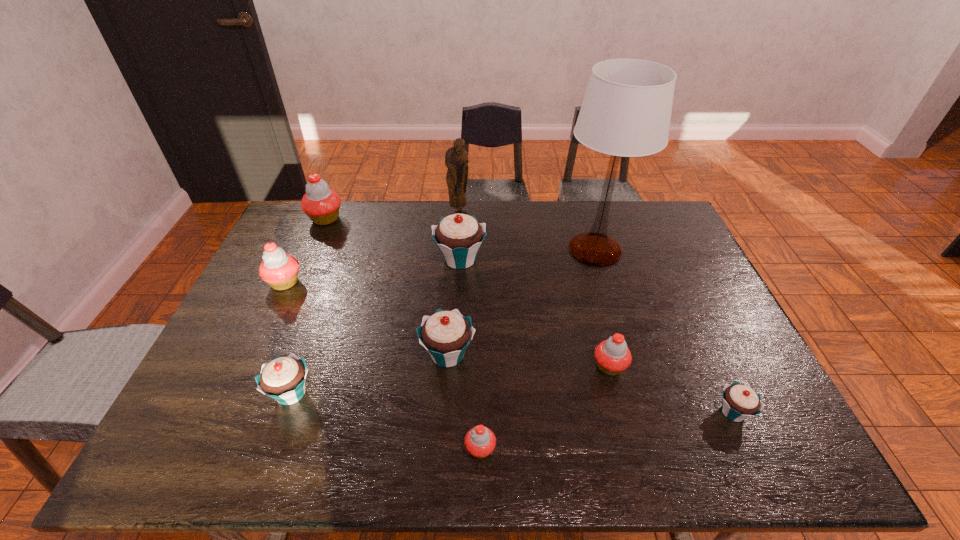
At what (x,y) coordinates should I click in order to perform the action: click on the rightmost teal cupcake. Please return your answer as a coordinate pair (x, y). Looking at the image, I should click on (739, 401).

The width and height of the screenshot is (960, 540). I want to click on the rightmost cupcake, so click(x=739, y=401).

Locate an element on the screen. The image size is (960, 540). the second red cupcake from right to left is located at coordinates (480, 441).

Locate an element on the screen. This screenshot has width=960, height=540. the smallest red cupcake is located at coordinates (480, 441).

What are the coordinates of `vacant point located 0.290m above the cylindrical shade of the table lamp` in the screenshot? It's located at click(x=624, y=349).

The width and height of the screenshot is (960, 540). I want to click on vacant space located 0.330m on the front-facing side of the ninth shortest object, so click(455, 272).

Identify the location of vacant area situated on the right of the farthest teal cupcake. (536, 259).

Image resolution: width=960 pixels, height=540 pixels. I want to click on free space located 0.230m on the right of the farthest red cupcake, so click(408, 219).

You are a GUI agent. You are given a task and a screenshot of the screen. Output one action in this format:
    pyautogui.click(x=<x>, y=<y>)
    Task: Click on the vacant region located 0.180m on the right of the third smallest red cupcake
    The image size is (960, 540).
    Given the screenshot: What is the action you would take?
    pyautogui.click(x=361, y=282)

At what (x,y) coordinates should I click in order to perform the action: click on vacant region located on the left of the second biggest teal cupcake. Please return your answer as a coordinate pair (x, y). This screenshot has height=540, width=960. Looking at the image, I should click on (283, 354).